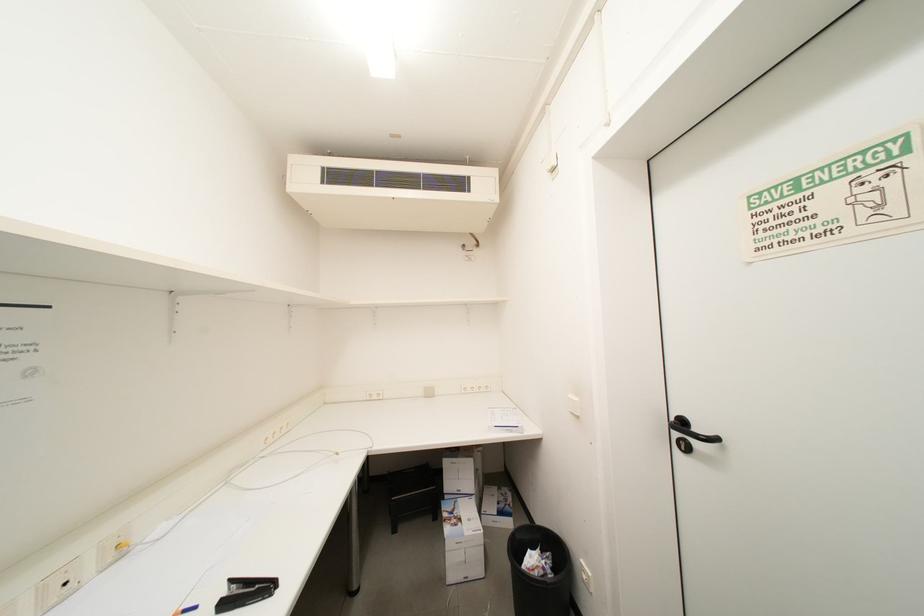
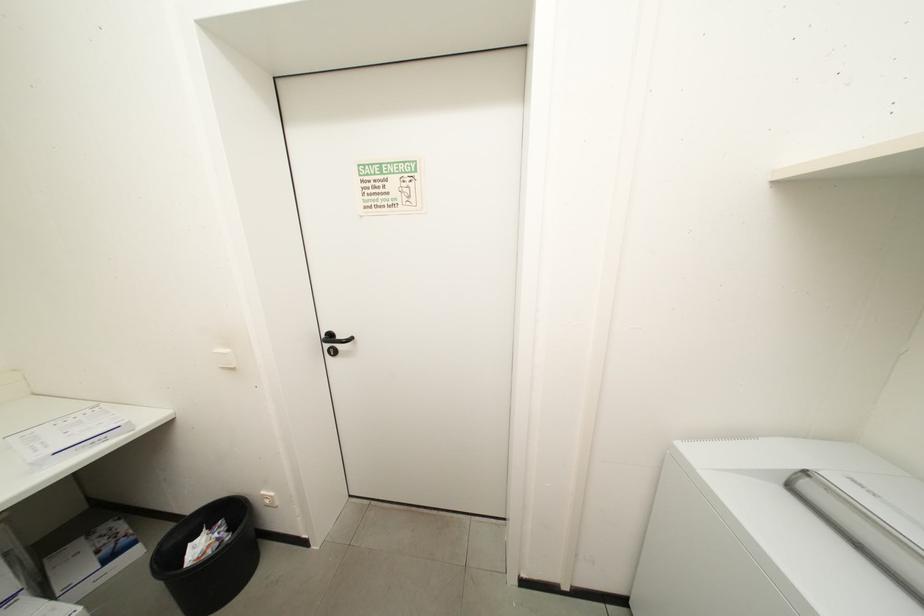
Question: The first image is from the beginning of the video and the second image is from the end. How did the camera likely rotate when shooting the video?

Choices:
 (A) Left
 (B) Right
 (C) Up
 (D) Down

Answer: (B)